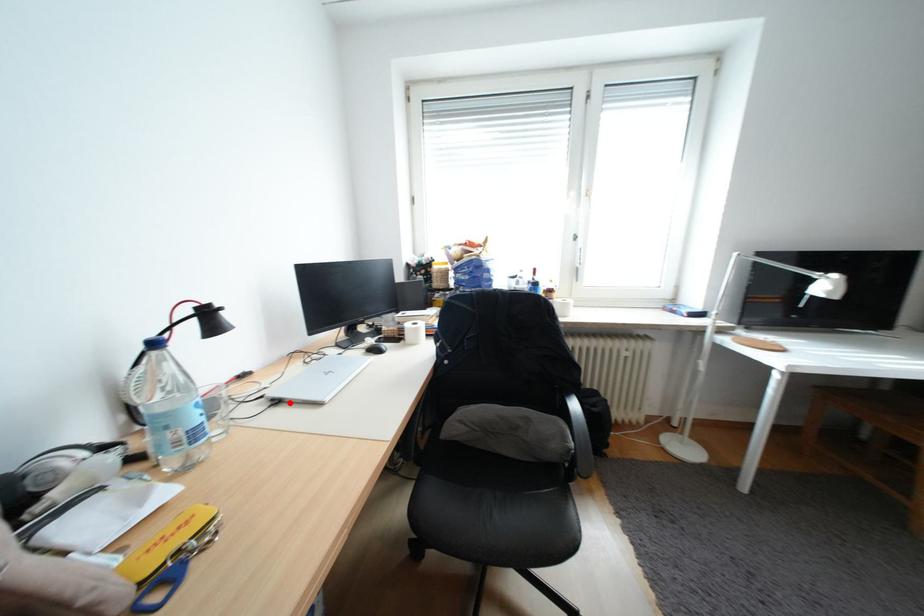
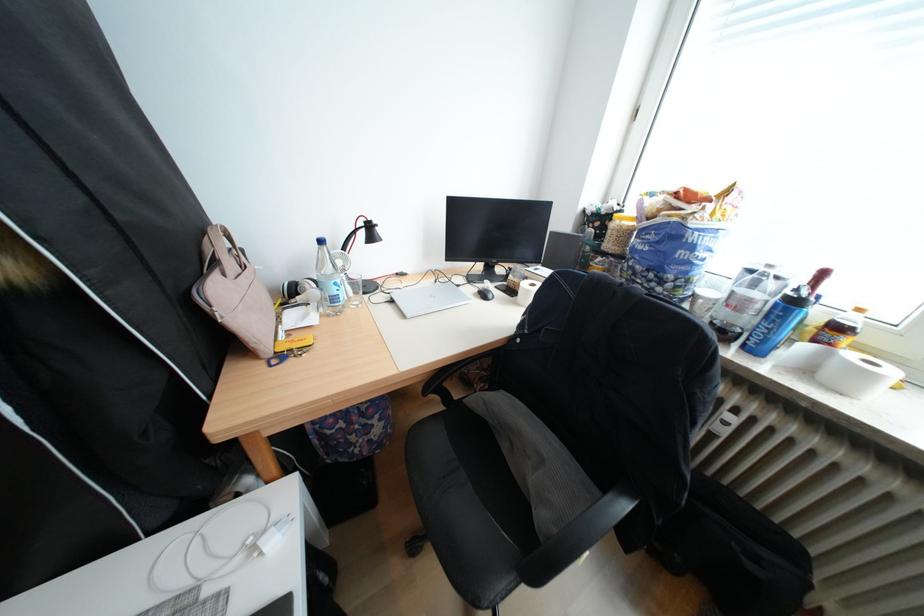
Where in the second image is the point corresponding to the highlighted location from the first image?

(405, 302)